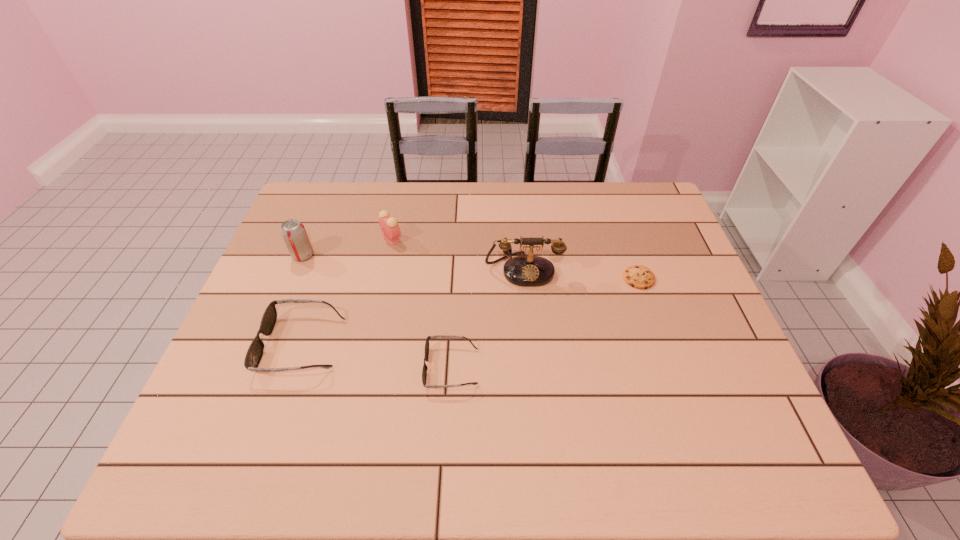
Locate an element on the screen. This screenshot has height=540, width=960. free space that is in between the second shortest object and the shortest object is located at coordinates (545, 322).

In order to click on free point between the fourth tallest object and the alarm clock in this screenshot , I will do `click(347, 291)`.

The image size is (960, 540). What are the coordinates of `empty location between the farthest object and the left sunglasses` in the screenshot? It's located at (347, 291).

At what (x,y) coordinates should I click in order to perform the action: click on empty location between the alarm clock and the soda can. Please return your answer as a coordinate pair (x, y). The image size is (960, 540). Looking at the image, I should click on (348, 247).

Locate an element on the screen. The width and height of the screenshot is (960, 540). free spot between the left sunglasses and the shortest object is located at coordinates (470, 311).

Choose which object is the third nearest neighbor to the soda can. Please provide its 2D coordinates. Your answer should be formatted as a tuple, i.e. [(x, y)], where the tuple contains the x and y coordinates of a point satisfying the conditions above.

[(424, 371)]

Identify which object is located as the second nearest to the second object from right to left. Please provide its 2D coordinates. Your answer should be formatted as a tuple, i.e. [(x, y)], where the tuple contains the x and y coordinates of a point satisfying the conditions above.

[(424, 371)]

This screenshot has height=540, width=960. What are the coordinates of `blank space that satisfies the following two spatial constraints: 1. on the face of the fourth shortest object; 2. on the right side of the shortest object` in the screenshot? It's located at (383, 278).